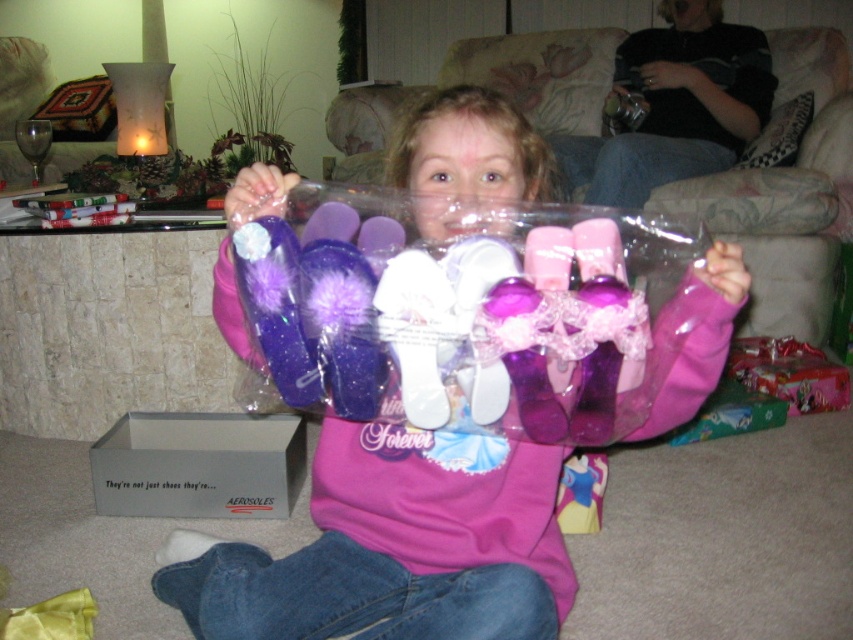
You are a guest at a party and you see the matte purple shoes at center and the gray cardboard box at lower left. Which object is positioned to the right side of the other?

The matte purple shoes at center is to the right of gray cardboard box at lower left.

You are helping organize a gift wrapping station. You have a matte purple shoes at center and a gray cardboard box at lower left. Which item requires more space when placing them side by side on the table?

The matte purple shoes at center requires more space when placing them side by side on the table because it has a larger size compared to the gray cardboard box at lower left.

In the scene shown: You are a delivery person who just arrived at the address. You need to place a new gray cardboard box at lower left near the existing one. However, you notice the matte purple shoes at center are blocking the path. Can you move the shoes to make space?

The matte purple shoes at center is in front of gray cardboard box at lower left, so moving the matte purple shoes at center would allow access to place the new box near the existing one.